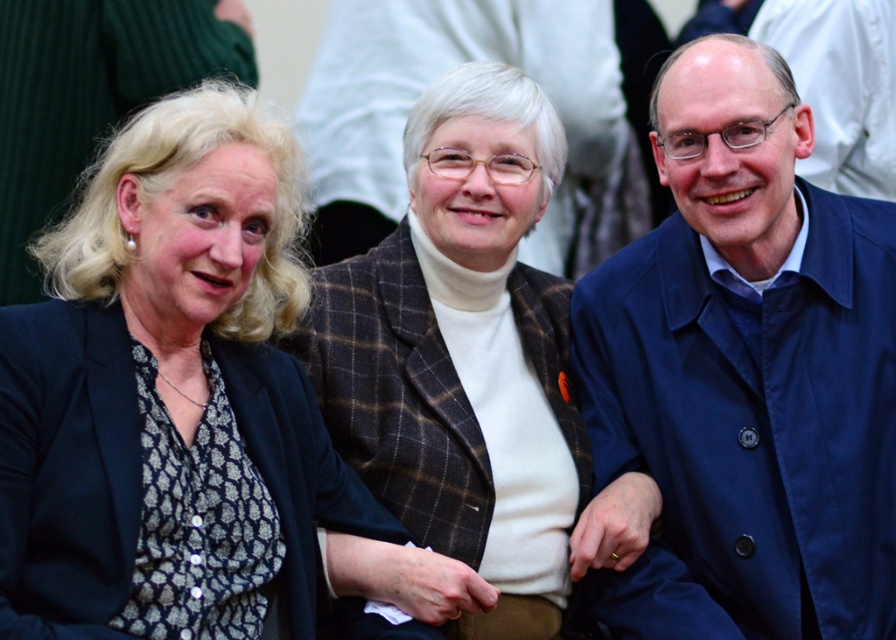
Question: Can you confirm if blue fabric coat at right is positioned above brown plaid blazer at center?

Choices:
 (A) no
 (B) yes

Answer: (A)

Question: Does blue fabric coat at right have a lesser width compared to brown plaid blazer at center?

Choices:
 (A) no
 (B) yes

Answer: (A)

Question: Among these objects, which one is nearest to the camera?

Choices:
 (A) brown plaid blazer at center
 (B) matte black blazer at left
 (C) blue fabric coat at right

Answer: (B)

Question: Does matte black blazer at left appear over brown plaid blazer at center?

Choices:
 (A) yes
 (B) no

Answer: (B)

Question: Which object appears closest to the camera in this image?

Choices:
 (A) blue fabric coat at right
 (B) brown plaid blazer at center

Answer: (B)

Question: Based on their relative distances, which object is farther from the blue fabric coat at right?

Choices:
 (A) brown plaid blazer at center
 (B) matte black blazer at left

Answer: (B)